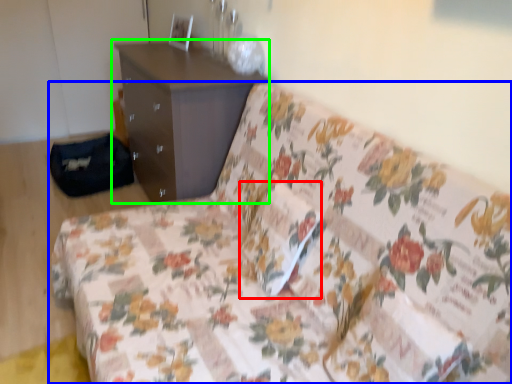
Question: Which object is the closest to the pillow (highlighted by a red box)? Choose among these: studio couch (highlighted by a blue box) or chest of drawers (highlighted by a green box).

Choices:
 (A) studio couch
 (B) chest of drawers

Answer: (A)